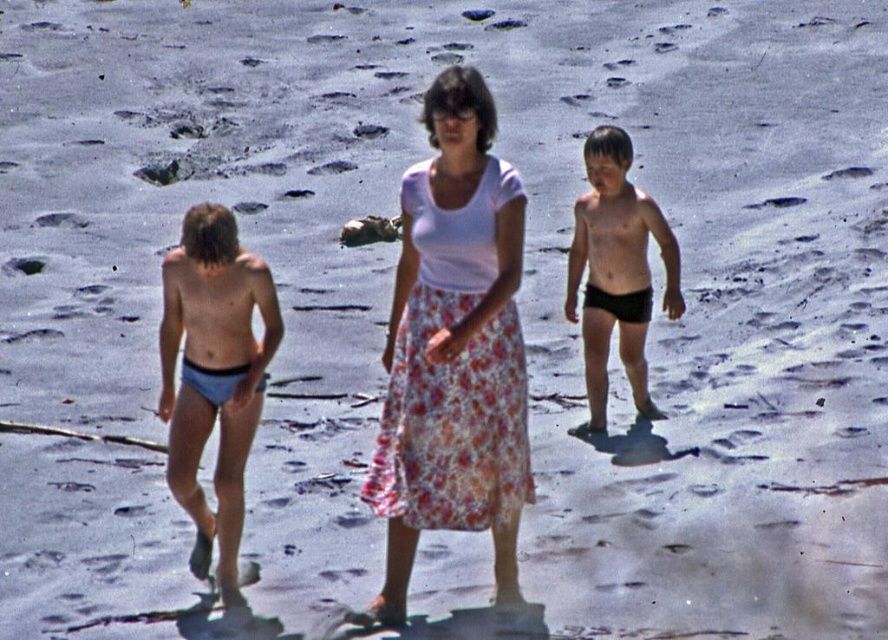
Question: Is the position of white floral skirt at center more distant than that of light blue fabric shorts at left?

Choices:
 (A) yes
 (B) no

Answer: (B)

Question: Based on their relative distances, which object is farther from the white floral skirt at center?

Choices:
 (A) light blue fabric shorts at left
 (B) black matte shorts at right

Answer: (B)

Question: Which point is closer to the camera taking this photo?

Choices:
 (A) (391, 301)
 (B) (216, 358)

Answer: (B)

Question: Is light blue fabric shorts at left in front of black matte shorts at right?

Choices:
 (A) no
 (B) yes

Answer: (B)

Question: Which point is closer to the camera?

Choices:
 (A) light blue fabric shorts at left
 (B) black matte shorts at right

Answer: (A)

Question: Does white floral skirt at center have a greater width compared to light blue fabric shorts at left?

Choices:
 (A) yes
 (B) no

Answer: (A)